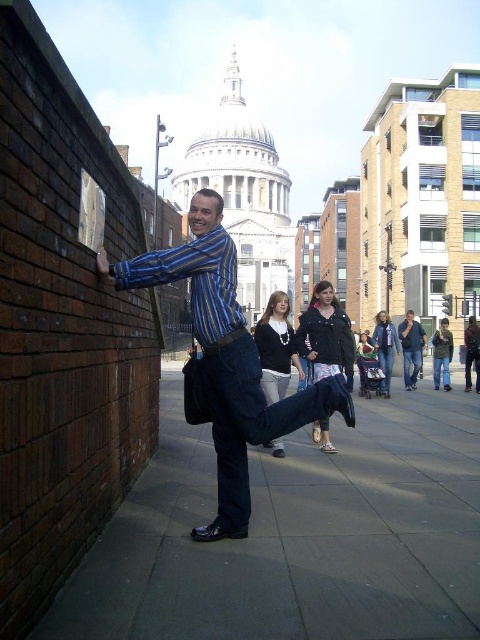
You are a tour guide leading a group to the historical building in the background. You want to point out two specific points to your group. The first point is at coordinates point (x=354, y=353) and the second point is at coordinates point (x=389, y=317). Which of these two points is closer to the historical building in the background?

Point (x=389, y=317) is closer to the historical building in the background because it is behind point (x=354, y=353).

You are a fashion photographer who wants to capture the denim jacket at center and dark blue denim jeans at center in a photo. Which piece of clothing is positioned to the left side of the other?

The dark blue denim jeans at center are to the left of the denim jacket at center.

You are a fashion designer observing a model dressed in a dark gray sweater at center and dark blue jeans at center. Which clothing item is wider?

The dark gray sweater at center is wider than the dark blue jeans at center.